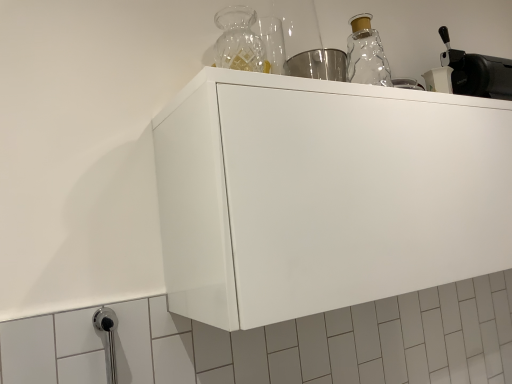
Question: Is white matte cabinet at center inside the boundaries of black matte coffee machine at upper right, or outside?

Choices:
 (A) inside
 (B) outside

Answer: (B)

Question: From their relative heights in the image, would you say white matte cabinet at center is taller or shorter than black matte coffee machine at upper right?

Choices:
 (A) short
 (B) tall

Answer: (B)

Question: Is point (406, 208) positioned closer to the camera than point (502, 59)?

Choices:
 (A) farther
 (B) closer

Answer: (B)

Question: Based on their positions, is black matte coffee machine at upper right located to the left or right of white matte cabinet at center?

Choices:
 (A) right
 (B) left

Answer: (A)

Question: Is black matte coffee machine at upper right bigger or smaller than white matte cabinet at center?

Choices:
 (A) big
 (B) small

Answer: (B)

Question: Do you think black matte coffee machine at upper right is within white matte cabinet at center, or outside of it?

Choices:
 (A) outside
 (B) inside

Answer: (A)

Question: From the image's perspective, is black matte coffee machine at upper right positioned above or below white matte cabinet at center?

Choices:
 (A) below
 (B) above

Answer: (B)